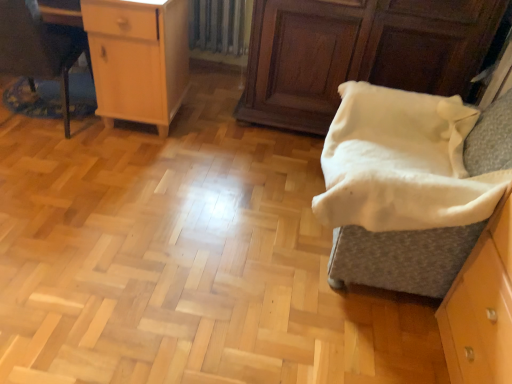
You are a GUI agent. You are given a task and a screenshot of the screen. Output one action in this format:
    pyautogui.click(x=<x>, y=<y>)
    Task: Click on the free location in front of wooden cabinet at upper right
    
    Given the screenshot: What is the action you would take?
    pyautogui.click(x=264, y=200)